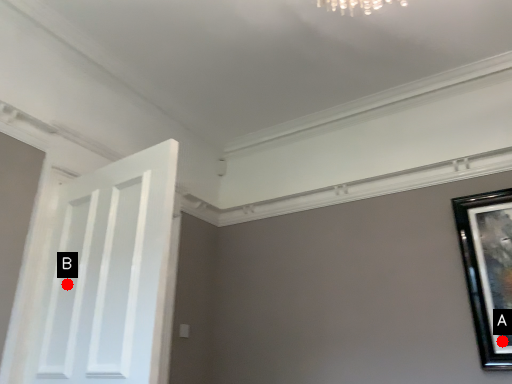
Question: Two points are circled on the image, labeled by A and B beside each circle. Which point is closer to the camera?

Choices:
 (A) A is closer
 (B) B is closer

Answer: (B)